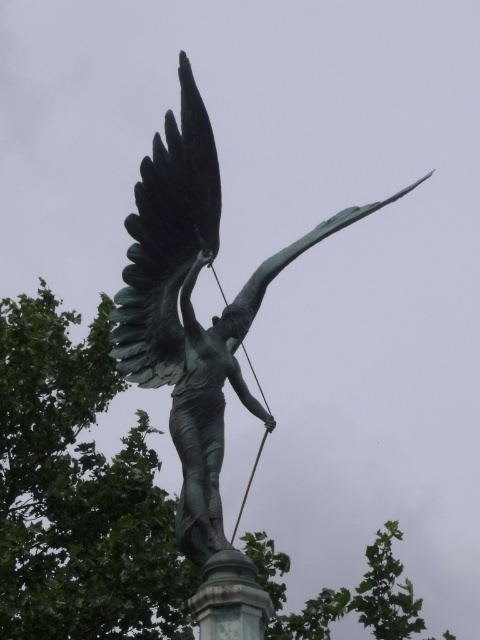
Can you confirm if green leafy tree at upper left is thinner than bronze statue at center?

No, green leafy tree at upper left is not thinner than bronze statue at center.

Can you confirm if green leafy tree at upper left is smaller than bronze statue at center?

No, green leafy tree at upper left is not smaller than bronze statue at center.

Locate an element on the screen. green leafy tree at upper left is located at coordinates tap(79, 492).

Identify the location of green leafy tree at upper left. This screenshot has height=640, width=480. (79, 492).

From the picture: Between bronze statue at center and green polished stone pillar at center, which one is positioned lower?

green polished stone pillar at center

Can you confirm if bronze statue at center is positioned to the left of green polished stone pillar at center?

Incorrect, bronze statue at center is not on the left side of green polished stone pillar at center.

Is point (191, 204) more distant than point (225, 608)?

Yes, point (191, 204) is behind point (225, 608).

The image size is (480, 640). What are the coordinates of `bronze statue at center` in the screenshot? It's located at (192, 307).

Between point (23, 349) and point (250, 570), which one is positioned behind?

Point (23, 349)

Can you confirm if green leafy tree at upper left is positioned to the left of green polished stone pillar at center?

Indeed, green leafy tree at upper left is positioned on the left side of green polished stone pillar at center.

Locate an element on the screen. Image resolution: width=480 pixels, height=640 pixels. green leafy tree at upper left is located at coordinates (79, 492).

This screenshot has height=640, width=480. I want to click on green leafy tree at upper left, so pyautogui.click(x=79, y=492).